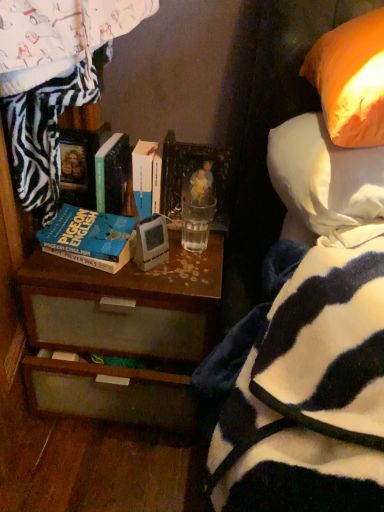
Locate an element on the screen. space that is in front of blue matte book at center left, which appears as the 1th book when viewed from the left is located at coordinates (85, 276).